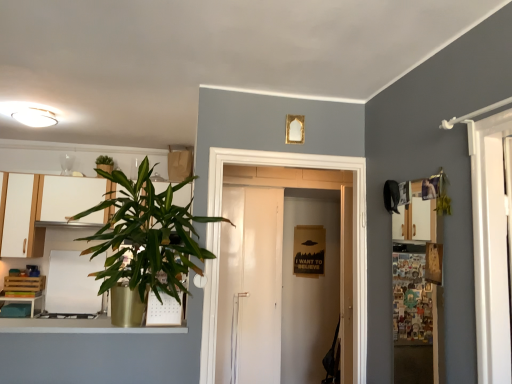
Question: Is wooden at left inside the boundaries of white glossy door at center, or outside?

Choices:
 (A) inside
 (B) outside

Answer: (B)

Question: Is point [x=41, y=299] closer or farther from the camera than point [x=211, y=157]?

Choices:
 (A) closer
 (B) farther

Answer: (B)

Question: Which object is the farthest from the wooden at left?

Choices:
 (A) matte white cabinet at left, the 2th cabinetry viewed from the right
 (B) wooden cutting board at upper right
 (C) white matte dry erase board at left
 (D) white matte cabinet at left, positioned as the first cabinetry in right-to-left order
 (E) white glossy door at center

Answer: (B)

Question: Considering the real-world distances, which object is closest to the green leafy plant at upper left, acting as the 2th houseplant starting from the right?

Choices:
 (A) white glossy door at center
 (B) white matte cabinet at left, the 2th cabinetry from the left
 (C) matte white cabinet at left, which appears as the 1th cabinetry when viewed from the left
 (D) wooden cutting board at upper right
 (E) wooden at left

Answer: (B)